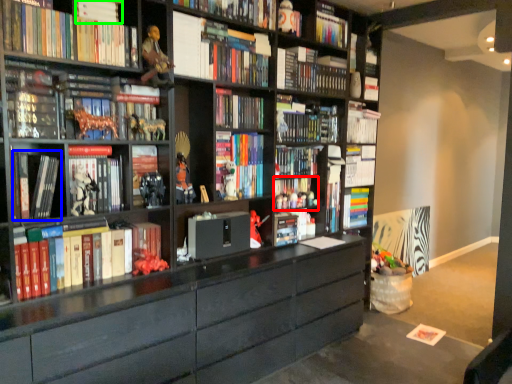
Question: Considering the real-world distances, which object is farthest from book (highlighted by a red box)? book (highlighted by a blue box) or book (highlighted by a green box)?

Choices:
 (A) book
 (B) book

Answer: (B)